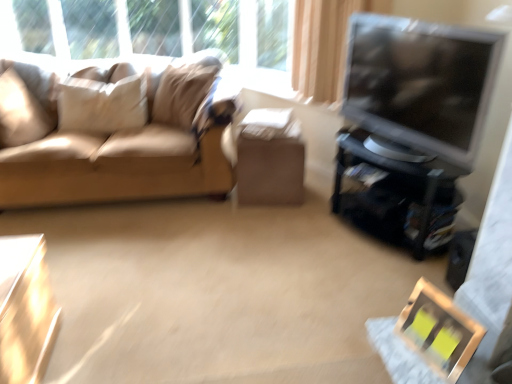
Identify the location of free space between shiny metallic table at lower left, placed as the first table when sorted from left to right, and matte black tv stand at right. The width and height of the screenshot is (512, 384). (234, 289).